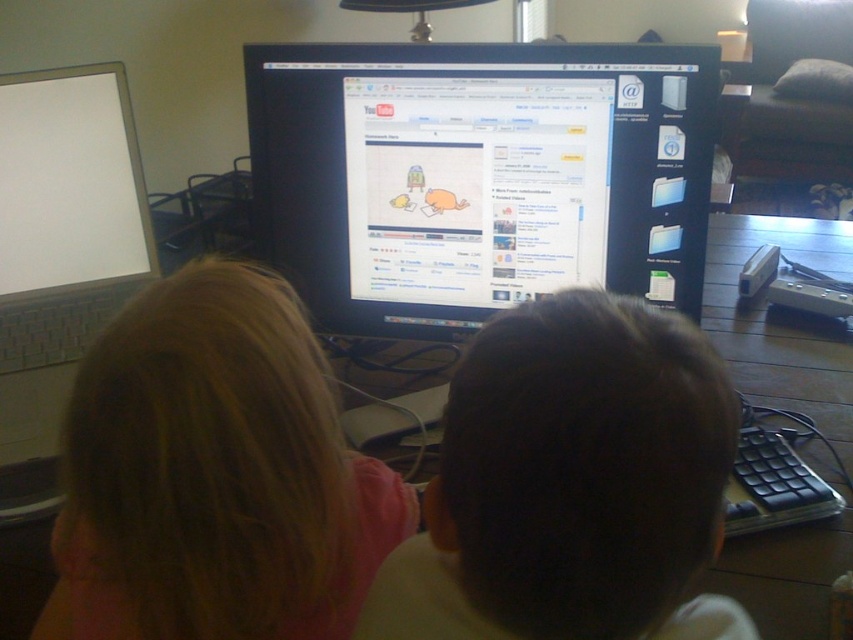
Question: Which point is closer to the camera?

Choices:
 (A) (264, 244)
 (B) (16, 164)
 (C) (323, 467)
 (D) (704, 476)

Answer: (D)

Question: Which of the following is the closest to the observer?

Choices:
 (A) (387, 179)
 (B) (308, 554)
 (C) (90, 234)

Answer: (B)

Question: Can you confirm if dark brown hair at center is wider than white glossy laptop at left?

Choices:
 (A) no
 (B) yes

Answer: (B)

Question: Does black glossy monitor at center have a larger size compared to dark brown hair at center?

Choices:
 (A) yes
 (B) no

Answer: (A)

Question: Which of these objects is positioned closest to the black glossy monitor at center?

Choices:
 (A) dark brown hair at center
 (B) blonde hair at upper left
 (C) white glossy laptop at left

Answer: (B)

Question: Does blonde hair at upper left appear over dark brown hair at center?

Choices:
 (A) no
 (B) yes

Answer: (B)